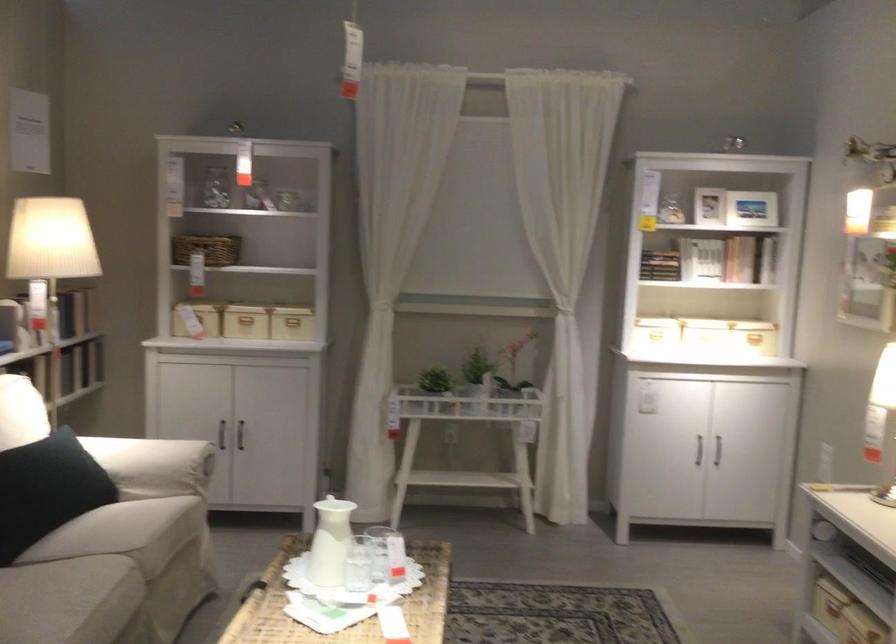
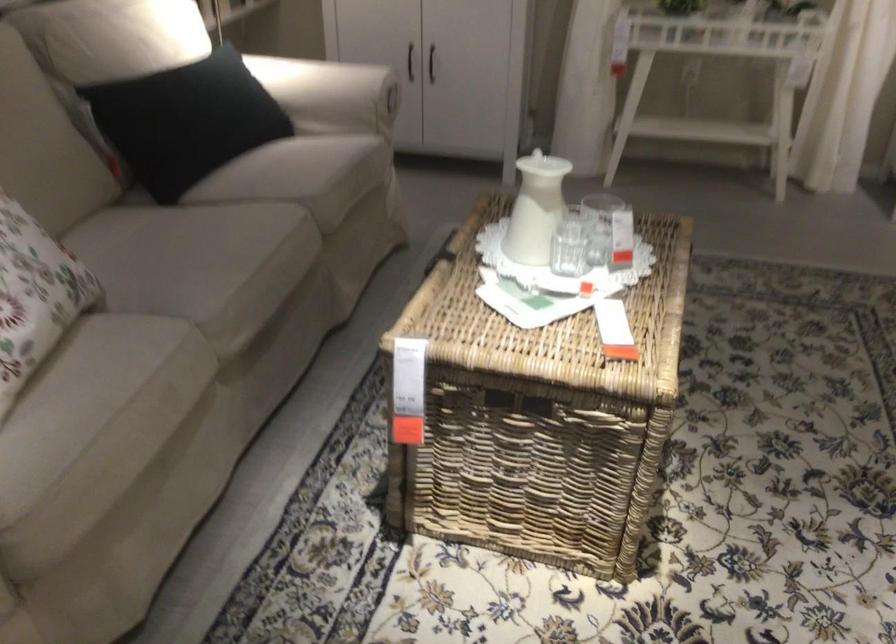
Question: The first image is from the beginning of the video and the second image is from the end. How did the camera likely rotate when shooting the video?

Choices:
 (A) Left
 (B) Right
 (C) Up
 (D) Down

Answer: (D)